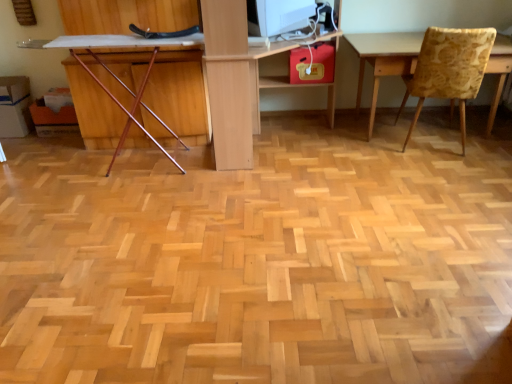
Locate an element on the screen. The width and height of the screenshot is (512, 384). free space in front of yellow floral fabric chair at right, the 1th chair positioned from the right is located at coordinates (449, 169).